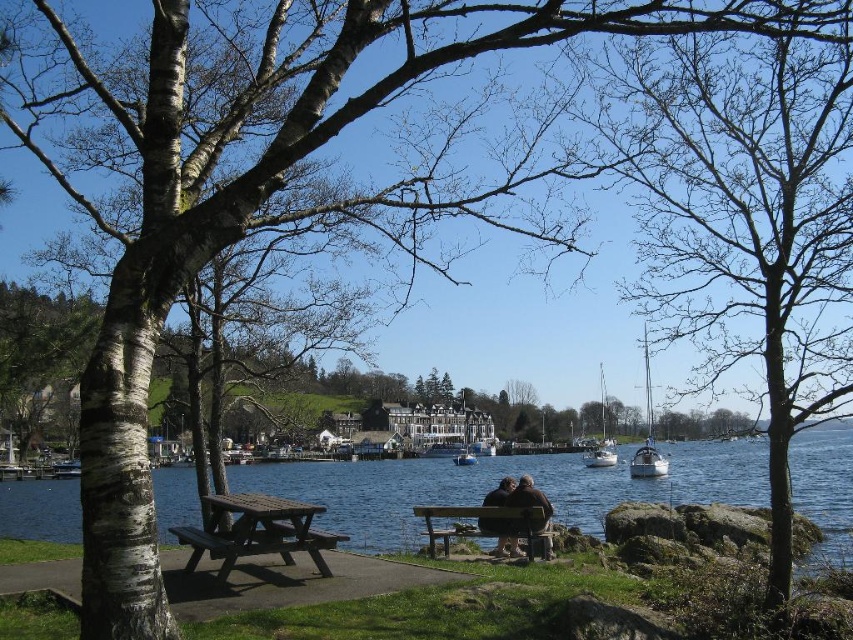
From the picture: You are planning to take a photo of the white glossy sailboat at right from the brown wooden bench at center. Since the bench is on the path, will you have to move to the left or the right to get a clear view of the sailboat?

The brown wooden bench at center is to the left of the white glossy sailboat at right. To get a clear view of the white glossy sailboat at right, you would need to move to the right from the bench.

You are standing at the point labeled as point (498,532) on the brown leather jacket at center. Looking towards the birch tree with white bark and dark branches in the foreground, can you see the row of classic buildings across the lake?

Yes, because the point (498,532) is on the brown leather jacket at center, which is located on the picnic table and bench where two people are seated. Since the birch tree is in the foreground and the row of classic buildings are in the middle ground across the lake, the buildings should be visible beyond the tree.